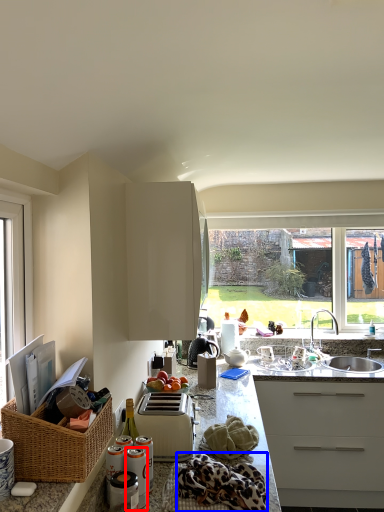
Question: Among these objects, which one is farthest to the camera, appliance (highlighted by a red box) or blanket (highlighted by a blue box)?

Choices:
 (A) appliance
 (B) blanket

Answer: (A)